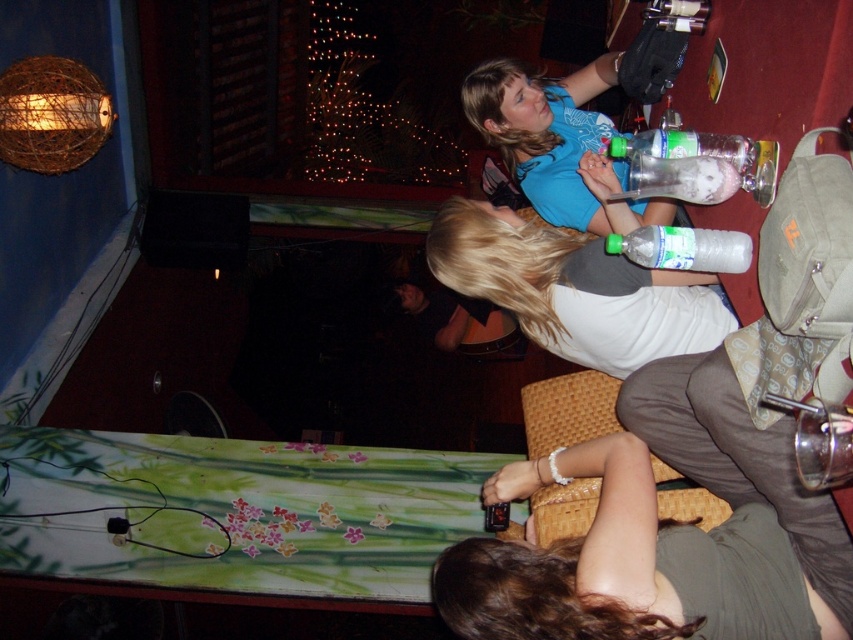
Based on the photo, you are at the entrance of the room and want to sit in the woven brown chair at lower center. Based on the coordinates provided in the scene description, can you determine if the chair is positioned closer to the left or right side of the room?

The woven brown chair at lower center is located at point 0.642 on the x and y axis, which means it is positioned closer to the right side of the room since the x coordinate is higher than 0.5.

You are at a party and need to place your phone on the table. The table has a woven brown chair at lower center and a green plastic bottle at center. Which object can you place your phone on without moving either of them?

You can place your phone on the woven brown chair at lower center because it has a larger size compared to the green plastic bottle at center, making it a more stable surface.

Consider the image. You are at a party and want to place your phone on the table without covering any items. The blue fabric shirt at upper center and the translucent plastic bottle at upper center are already on the table. Which item do you need to move to make space?

The blue fabric shirt at upper center is wider than the translucent plastic bottle at upper center, so moving the blue fabric shirt at upper center would create more space.